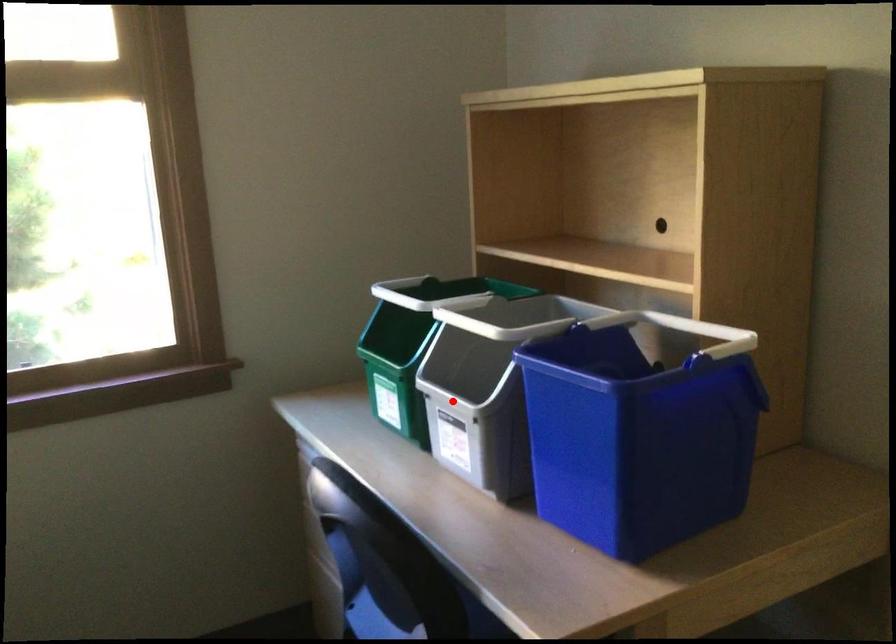
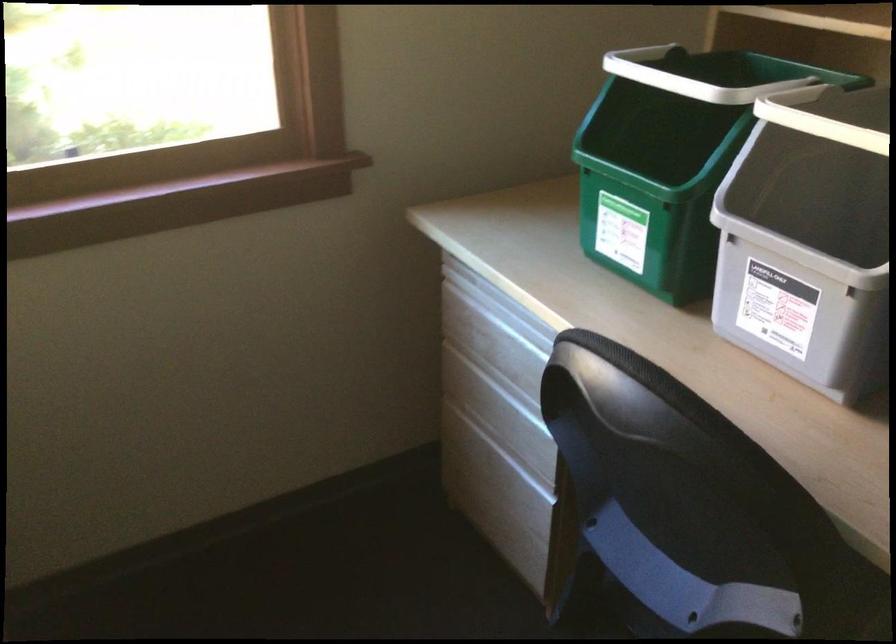
Question: I am providing you with two images of the same scene from different viewpoints. In image1, a red point is highlighted. Considering the same 3D point in image2, which of the following is correct?

Choices:
 (A) It is closer
 (B) It is farther

Answer: (A)